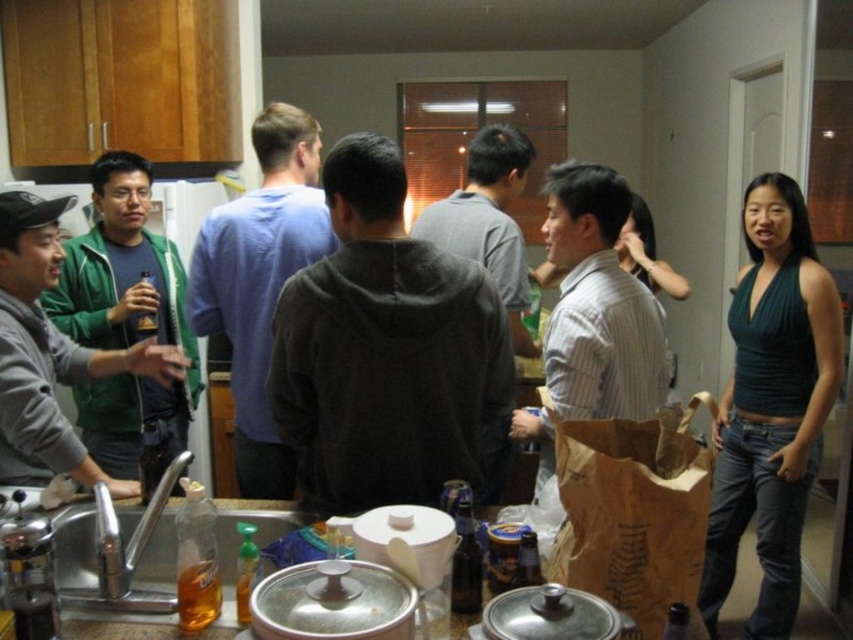
You are organizing a closet and see the green matte jacket at left and the blue cotton shirt at center. Which item should you place first if you are moving from left to right?

The green matte jacket at left should be placed first since it is positioned to the left of the blue cotton shirt at center, following the left to right order.

What is located at the point with coordinates (125, 323) in the image?

The point with coordinates (125, 323) is located on the green matte jacket at left.

You are a guest at this gathering and you want to grab the striped cotton shirt at center to wipe a spill. However, the brown paper bag at center is in the way. Can you easily reach the shirt without moving the bag?

The brown paper bag at center is located below the striped cotton shirt at center, so you can reach the shirt by moving your hand over the bag or lifting it slightly without needing to move the entire bag out of the way.